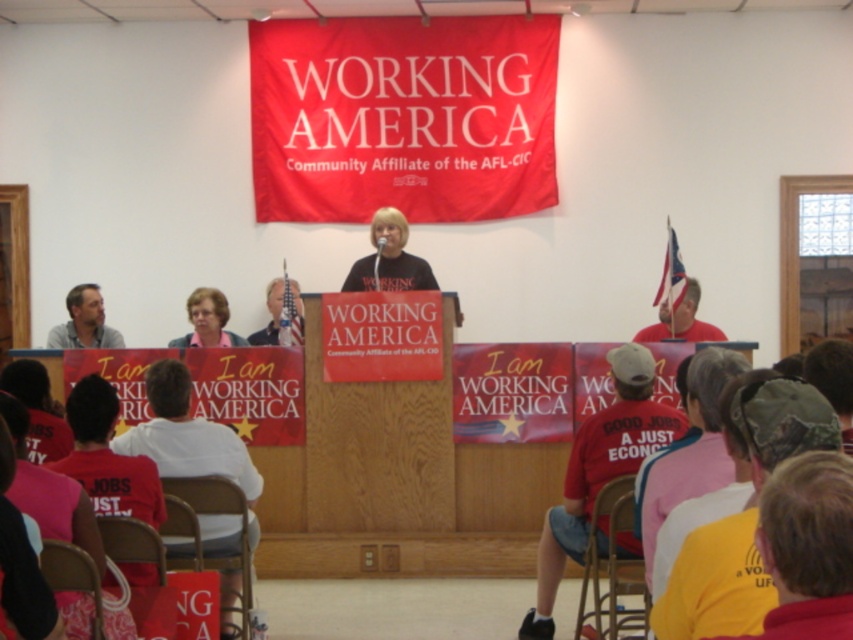
Can you confirm if matte gray shirt at left is shorter than pink fabric shirt at center?

In fact, matte gray shirt at left may be taller than pink fabric shirt at center.

Is point (80, 340) less distant than point (207, 316)?

No, (80, 340) is further to viewer.

Who is more distant from viewer, (70, 324) or (219, 344)?

The point (70, 324) is more distant.

Where is `matte gray shirt at left`? This screenshot has width=853, height=640. matte gray shirt at left is located at coordinates (84, 323).

Does pink fabric shirt at center appear on the right side of red t-shirt at right?

In fact, pink fabric shirt at center is to the left of red t-shirt at right.

Which is in front, point (192, 307) or point (695, 292)?

Point (192, 307) is in front.

Locate an element on the screen. Image resolution: width=853 pixels, height=640 pixels. pink fabric shirt at center is located at coordinates (207, 321).

The height and width of the screenshot is (640, 853). I want to click on pink fabric shirt at center, so click(207, 321).

Who is positioned more to the right, matte gray shirt at left or red t-shirt at right?

red t-shirt at right is more to the right.

Is point (91, 316) less distant than point (659, 312)?

No.

In order to click on matte gray shirt at left in this screenshot , I will do `click(84, 323)`.